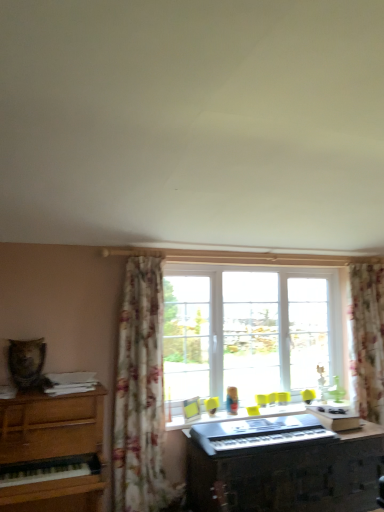
Question: From a real-world perspective, does floral fabric curtain at center, which is the 1th curtain in left-to-right order, stand above wooden piano at left?

Choices:
 (A) no
 (B) yes

Answer: (B)

Question: From the image's perspective, does floral fabric curtain at center, which appears as the second curtain when viewed from the right, appear higher than wooden piano at left?

Choices:
 (A) yes
 (B) no

Answer: (A)

Question: From the image's perspective, is floral fabric curtain at center, the first curtain from the front, below wooden piano at left?

Choices:
 (A) no
 (B) yes

Answer: (A)

Question: Is floral fabric curtain at center, the 2th curtain positioned from the back, bigger than wooden piano at left?

Choices:
 (A) no
 (B) yes

Answer: (A)

Question: Is floral fabric curtain at center, the 2th curtain positioned from the back, looking in the opposite direction of wooden piano at left?

Choices:
 (A) no
 (B) yes

Answer: (A)

Question: Does point (6, 406) appear closer or farther from the camera than point (115, 398)?

Choices:
 (A) closer
 (B) farther

Answer: (A)

Question: Is wooden piano at left wider or thinner than floral fabric curtain at center, the 2th curtain positioned from the back?

Choices:
 (A) thin
 (B) wide

Answer: (B)

Question: Based on their positions, is wooden piano at left located to the left or right of floral fabric curtain at center, which is the 1th curtain in left-to-right order?

Choices:
 (A) left
 (B) right

Answer: (A)

Question: From a real-world perspective, is wooden piano at left physically located above or below floral fabric curtain at center, the first curtain from the front?

Choices:
 (A) above
 (B) below

Answer: (B)

Question: From the image's perspective, is floral fabric curtain at center, which appears as the second curtain when viewed from the right, located above or below wooden piano at left?

Choices:
 (A) below
 (B) above

Answer: (B)

Question: Is floral fabric curtain at center, which appears as the second curtain when viewed from the right, in front of or behind wooden piano at left in the image?

Choices:
 (A) front
 (B) behind

Answer: (B)

Question: Considering the positions of floral fabric curtain at center, which appears as the second curtain when viewed from the right, and wooden piano at left in the image, is floral fabric curtain at center, which appears as the second curtain when viewed from the right, wider or thinner than wooden piano at left?

Choices:
 (A) thin
 (B) wide

Answer: (A)

Question: Would you say floral fabric curtain at center, the first curtain from the front, is inside or outside wooden piano at left?

Choices:
 (A) outside
 (B) inside

Answer: (A)

Question: Is wooden piano at left taller or shorter than black plastic musical keyboard at center?

Choices:
 (A) tall
 (B) short

Answer: (A)

Question: Which is correct: wooden piano at left is inside black plastic musical keyboard at center, or outside of it?

Choices:
 (A) outside
 (B) inside

Answer: (A)